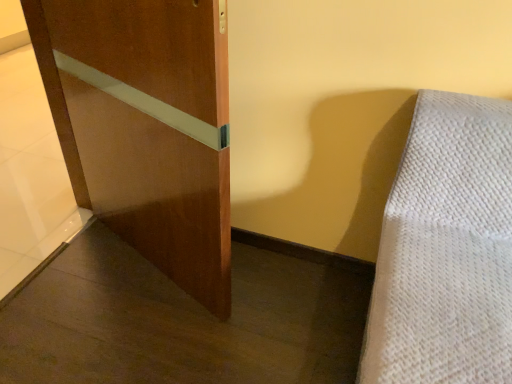
Locate an element on the screen. The height and width of the screenshot is (384, 512). vacant space in glossy wood door at center (from a real-world perspective) is located at coordinates (148, 267).